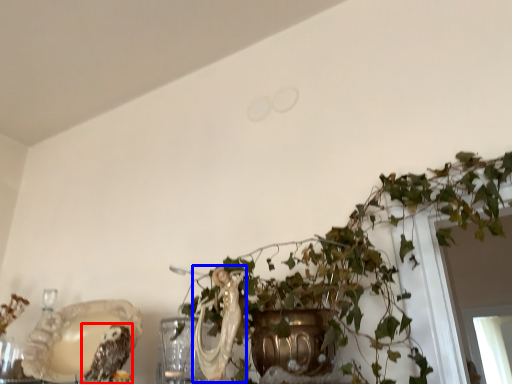
Question: Which point is further to the camera, owl (highlighted by a red box) or animal (highlighted by a blue box)?

Choices:
 (A) owl
 (B) animal

Answer: (A)